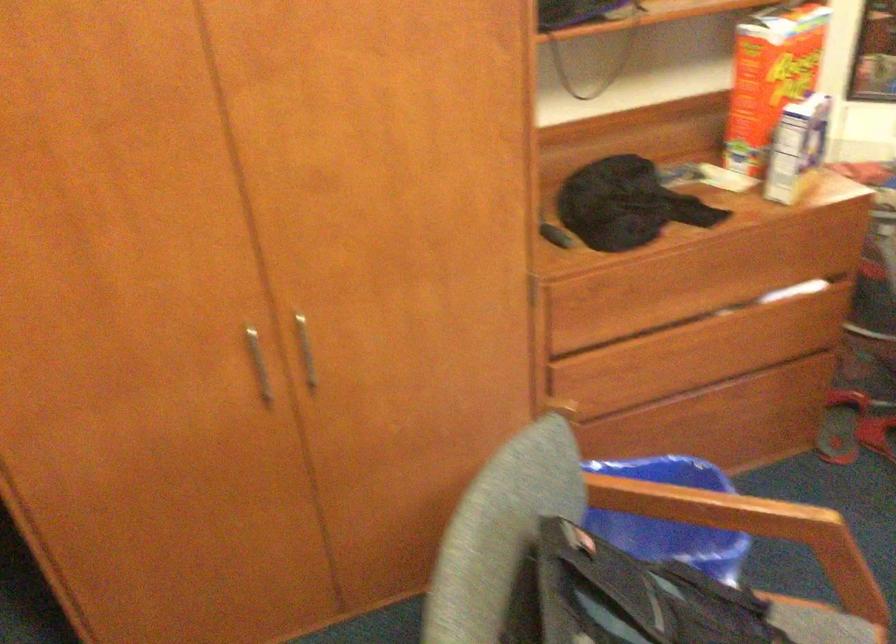
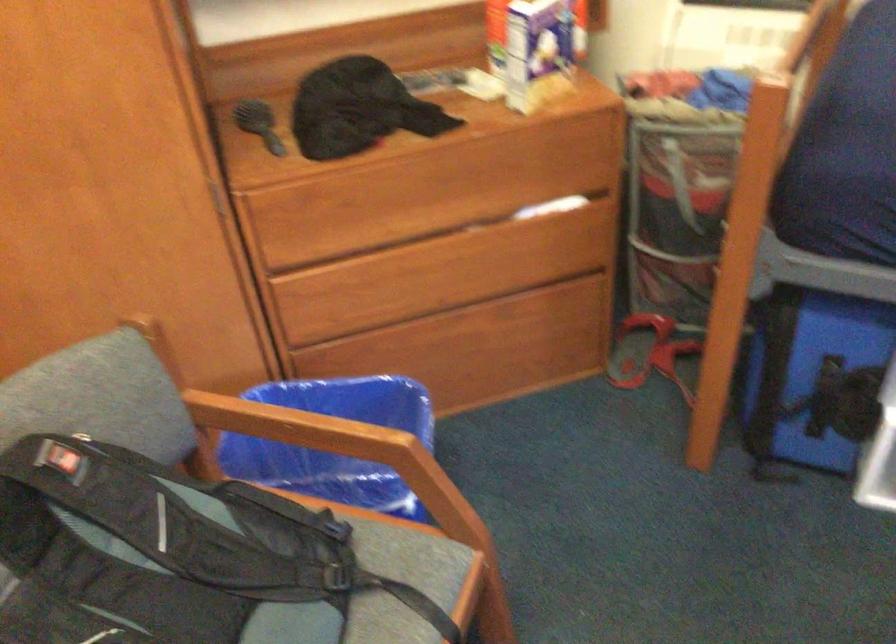
Find the pixel in the second image that matches point 693,401 in the first image.

(453, 319)